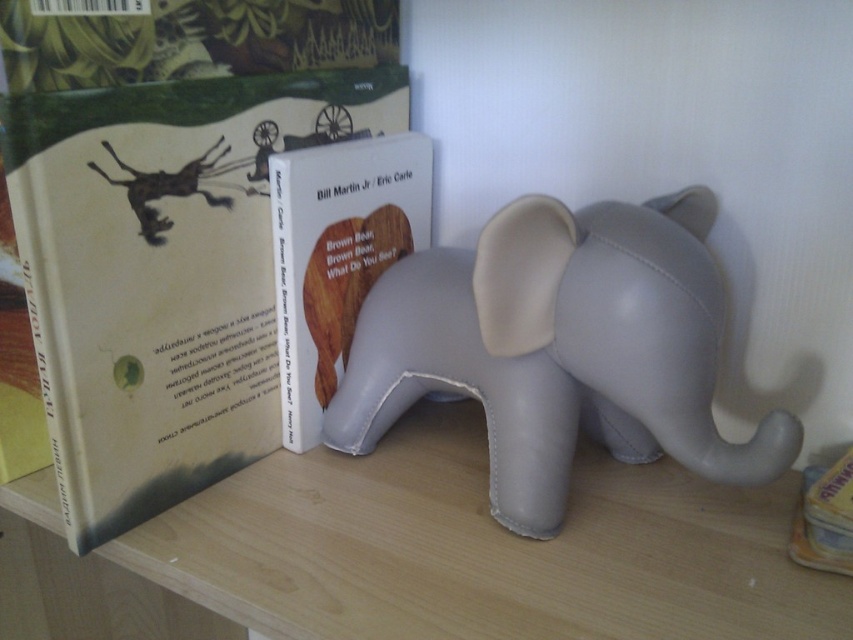
Is gray matte elephant at center shorter than matte white book at center?

Indeed, gray matte elephant at center has a lesser height compared to matte white book at center.

Who is more distant from viewer, (567, 262) or (422, 196)?

The point (422, 196) is more distant.

Locate an element on the screen. The width and height of the screenshot is (853, 640). gray matte elephant at center is located at coordinates (560, 348).

Which is more to the left, white paper at center or gray matte elephant at center?

white paper at center is more to the left.

Does point (78, 531) come farther from viewer compared to point (543, 532)?

No.

Between point (172, 218) and point (643, 401), which one is positioned behind?

The point (172, 218) is behind.

This screenshot has width=853, height=640. Find the location of `white paper at center`. white paper at center is located at coordinates (163, 273).

Between point (378, 99) and point (350, 272), which one is positioned in front?

Point (350, 272) is in front.

What do you see at coordinates (163, 273) in the screenshot? This screenshot has height=640, width=853. I see `white paper at center` at bounding box center [163, 273].

Between point (132, 474) and point (287, 321), which one is positioned in front?

Point (132, 474)

The width and height of the screenshot is (853, 640). What are the coordinates of `white paper at center` in the screenshot? It's located at (163, 273).